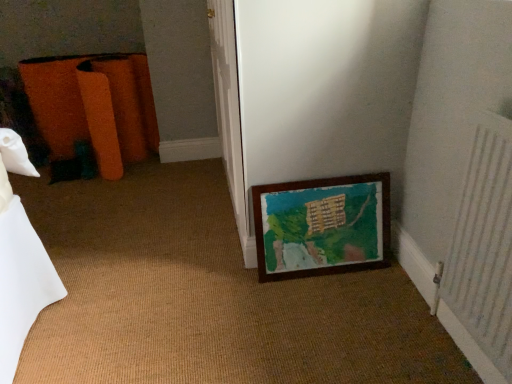
Find the location of a particular element. This screenshot has height=384, width=512. vacant area on the back side of white textured radiator at right is located at coordinates (393, 301).